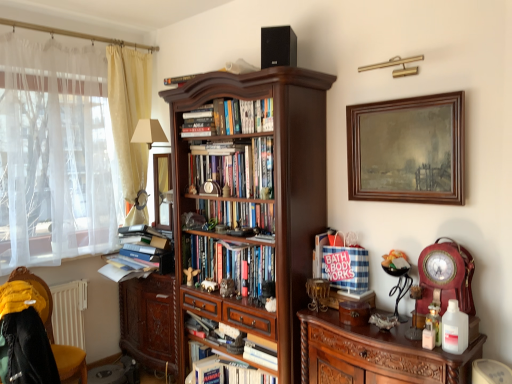
The width and height of the screenshot is (512, 384). Identify the location of free space above wooden framed painting at upper right, which is the 1th picture frame in top-to-bottom order (from a real-world perspective). (405, 97).